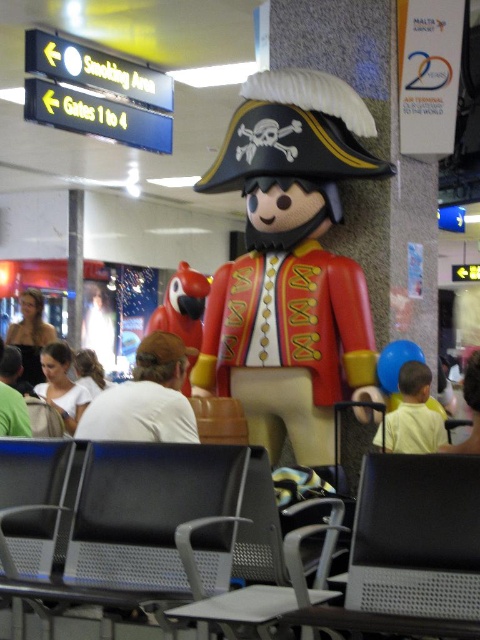
Is metallic gray chair at lower left below light yellow shirt at center?

Correct, metallic gray chair at lower left is located below light yellow shirt at center.

Can you confirm if metallic gray chair at lower left is positioned to the left of light yellow shirt at center?

Correct, you'll find metallic gray chair at lower left to the left of light yellow shirt at center.

Which is behind, point (43, 556) or point (424, 396)?

Positioned behind is point (424, 396).

Locate an element on the screen. metallic gray chair at lower left is located at coordinates (31, 504).

Is point (384, 449) in front of point (186, 301)?

Yes, it is.

Who is lower down, light yellow shirt at center or matte red parrot at center?

light yellow shirt at center is below.

Measure the distance between light yellow shirt at center and camera.

light yellow shirt at center is 5.32 meters away from camera.

Image resolution: width=480 pixels, height=640 pixels. I want to click on light yellow shirt at center, so click(412, 416).

Who is higher up, light yellow shirt at center or white matte shirt at center?

light yellow shirt at center

Is point (396, 412) farther from viewer compared to point (56, 365)?

No, it is not.

Locate an element on the screen. The height and width of the screenshot is (640, 480). light yellow shirt at center is located at coordinates (412, 416).